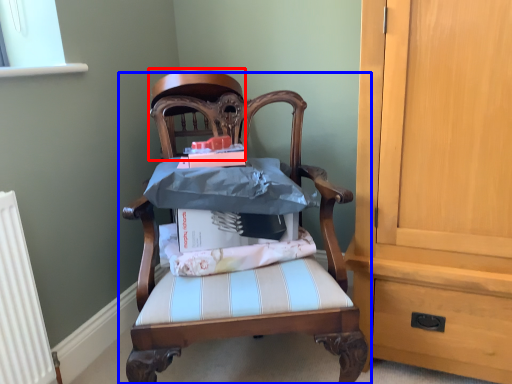
Question: Among these objects, which one is farthest to the camera, chair (highlighted by a red box) or chair (highlighted by a blue box)?

Choices:
 (A) chair
 (B) chair

Answer: (A)